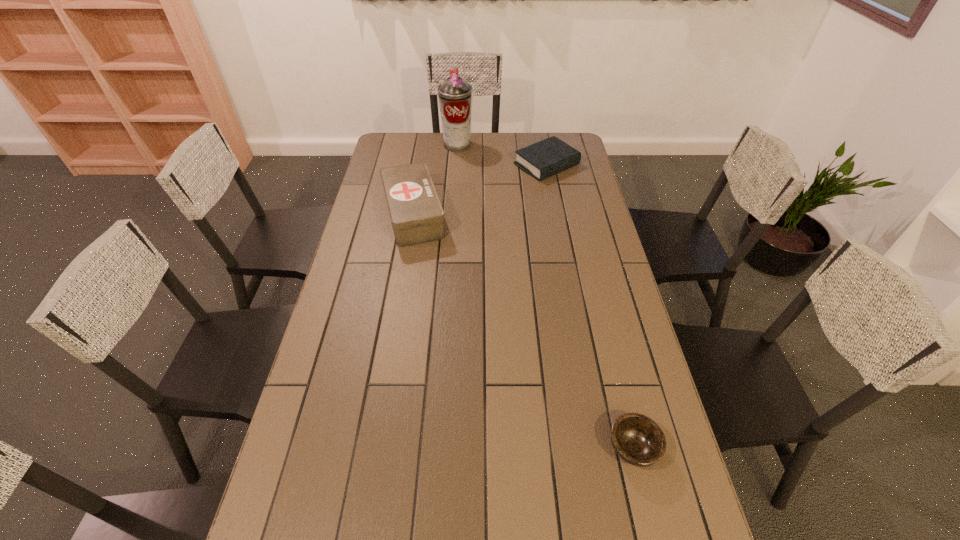
Identify which object is located as the third nearest to the Bible. Please provide its 2D coordinates. Your answer should be formatted as a tuple, i.e. [(x, y)], where the tuple contains the x and y coordinates of a point satisfying the conditions above.

[(638, 440)]

Find the location of a particular element. vacant space that satisfies the following two spatial constraints: 1. on the front side of the Bible; 2. on the right side of the nearest object is located at coordinates (601, 448).

Locate an element on the screen. free space in the image that satisfies the following two spatial constraints: 1. on the back side of the Bible; 2. on the right side of the third farthest object is located at coordinates (421, 165).

At what (x,y) coordinates should I click in order to perform the action: click on vacant area that satisfies the following two spatial constraints: 1. on the front side of the Bible; 2. on the left side of the tallest object. Please return your answer as a coordinate pair (x, y). The width and height of the screenshot is (960, 540). Looking at the image, I should click on (456, 165).